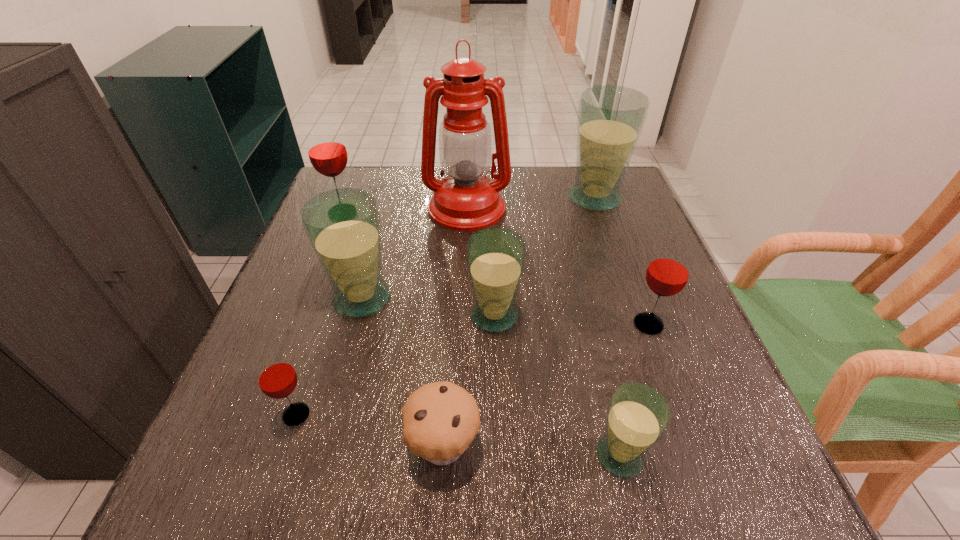
Locate an element on the screen. The height and width of the screenshot is (540, 960). free location located 0.210m on the back of the nearest red glass is located at coordinates [x=332, y=308].

This screenshot has height=540, width=960. What are the coordinates of `vacant space located 0.130m on the back of the nearest glass` in the screenshot? It's located at (598, 363).

This screenshot has height=540, width=960. I want to click on vacant area located on the back of the muffin, so click(x=453, y=284).

Locate an element on the screen. Image resolution: width=960 pixels, height=540 pixels. oil lamp at the far edge is located at coordinates (466, 200).

Where is `glass present at the near edge`? glass present at the near edge is located at coordinates (637, 417).

At what (x,y) coordinates should I click in order to perform the action: click on muffin located in the near edge section of the desktop. Please return your answer as a coordinate pair (x, y). This screenshot has height=540, width=960. Looking at the image, I should click on tap(440, 420).

Locate an element on the screen. The height and width of the screenshot is (540, 960). object present at the far left corner is located at coordinates (327, 152).

Find the location of a particular element. object present at the far right corner is located at coordinates (611, 118).

You are a GUI agent. You are given a task and a screenshot of the screen. Output one action in this format:
    pyautogui.click(x=<x>, y=<y>)
    Task: Click on the vacant space at the far edge of the desktop
    
    Given the screenshot: What is the action you would take?
    pyautogui.click(x=516, y=207)

In the image, there is a desktop. Where is `vacant area at the near edge`? vacant area at the near edge is located at coordinates (318, 488).